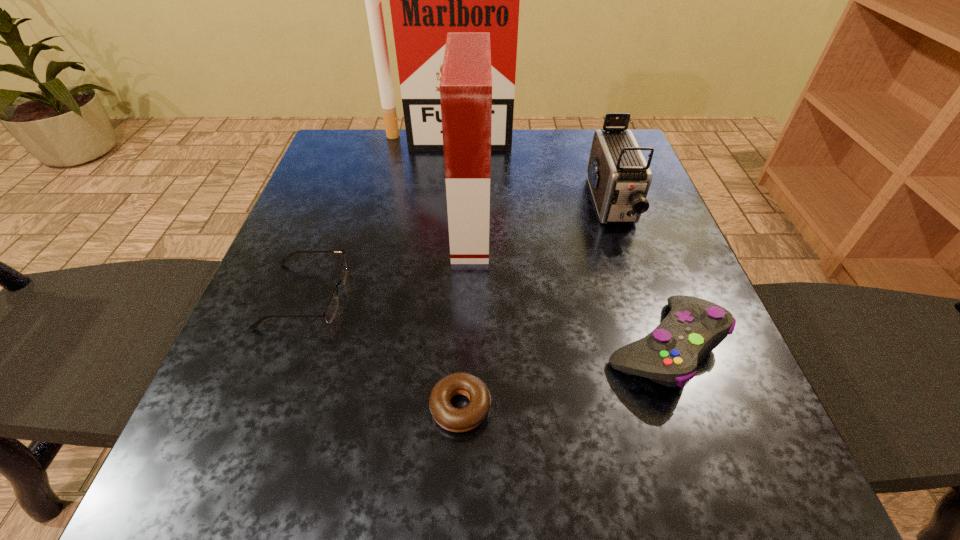
In the image, there is a desktop. Where is `free space at the far edge`? The width and height of the screenshot is (960, 540). free space at the far edge is located at coordinates (516, 180).

At what (x,y) coordinates should I click in order to perform the action: click on free space at the near edge. Please return your answer as a coordinate pair (x, y). Image resolution: width=960 pixels, height=540 pixels. Looking at the image, I should click on (309, 475).

Find the location of `vacant space at the left edge of the desktop`. vacant space at the left edge of the desktop is located at coordinates (340, 233).

The image size is (960, 540). I want to click on vacant space at the right edge, so click(x=584, y=201).

The width and height of the screenshot is (960, 540). Find the location of `free space at the far left corner`. free space at the far left corner is located at coordinates (354, 179).

Locate an element on the screen. vacant area that lies between the spectacles and the nearer cigarette_case is located at coordinates (388, 261).

This screenshot has height=540, width=960. I want to click on vacant area that lies between the farther cigarette_case and the control, so tap(556, 243).

The height and width of the screenshot is (540, 960). Find the location of `free point between the shortest object and the third tallest object`. free point between the shortest object and the third tallest object is located at coordinates (536, 306).

Where is `vacant area that lies between the third shortest object and the nearer cigarette_case`? This screenshot has width=960, height=540. vacant area that lies between the third shortest object and the nearer cigarette_case is located at coordinates (567, 286).

This screenshot has width=960, height=540. In order to click on empty space that is in between the doughnut and the third tallest object in this screenshot , I will do `click(536, 306)`.